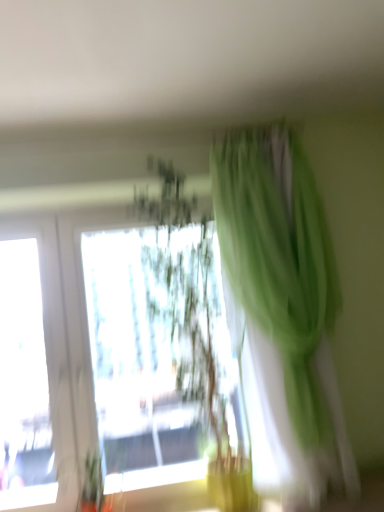
What do you see at coordinates (196, 327) in the screenshot?
I see `translucent green plant at center` at bounding box center [196, 327].

At what (x,y) coordinates should I click in order to perform the action: click on translucent green plant at center. Please return your answer as a coordinate pair (x, y). The width and height of the screenshot is (384, 512). Looking at the image, I should click on (196, 327).

Find the location of a particular element. The image size is (384, 512). green sheer curtain at upper right is located at coordinates (285, 300).

The height and width of the screenshot is (512, 384). Describe the element at coordinates (285, 300) in the screenshot. I see `green sheer curtain at upper right` at that location.

Where is `translucent green plant at center`? The width and height of the screenshot is (384, 512). translucent green plant at center is located at coordinates (196, 327).

In the image, is translucent green plant at center on the left side or the right side of green sheer curtain at upper right?

In the image, translucent green plant at center appears on the left side of green sheer curtain at upper right.

Is translucent green plant at center closer to camera compared to green sheer curtain at upper right?

No.

Which is further, (164, 213) or (244, 244)?

Point (164, 213)

From the image's perspective, would you say translucent green plant at center is shown under green sheer curtain at upper right?

Correct, translucent green plant at center appears lower than green sheer curtain at upper right in the image.

From a real-world perspective, between translucent green plant at center and green sheer curtain at upper right, who is vertically lower?

In real-world perspective, translucent green plant at center is lower.

Looking at this image, considering the sizes of objects translucent green plant at center and green sheer curtain at upper right in the image provided, who is thinner, translucent green plant at center or green sheer curtain at upper right?

green sheer curtain at upper right is thinner.

Considering the sizes of translucent green plant at center and green sheer curtain at upper right in the image, is translucent green plant at center taller or shorter than green sheer curtain at upper right?

Clearly, translucent green plant at center is taller compared to green sheer curtain at upper right.

Which of these two, translucent green plant at center or green sheer curtain at upper right, is bigger?

translucent green plant at center is bigger.

Is translucent green plant at center not within green sheer curtain at upper right?

That's correct, translucent green plant at center is outside of green sheer curtain at upper right.

Is translucent green plant at center not close to green sheer curtain at upper right?

No, translucent green plant at center is not far away from green sheer curtain at upper right.

Is green sheer curtain at upper right at the back of translucent green plant at center?

That's not correct — translucent green plant at center is not looking away from green sheer curtain at upper right.

This screenshot has height=512, width=384. What are the coordinates of `houseplant below the green sheer curtain at upper right (from a real-world perspective)` in the screenshot? It's located at (196, 327).

Does green sheer curtain at upper right appear on the left side of translucent green plant at center?

No.

Is green sheer curtain at upper right further to camera compared to translucent green plant at center?

That is False.

Does point (331, 442) appear closer or farther from the camera than point (209, 343)?

Point (331, 442) is positioned closer to the camera compared to point (209, 343).

From the image's perspective, which is above, green sheer curtain at upper right or translucent green plant at center?

From the image's view, green sheer curtain at upper right is above.

From a real-world perspective, is green sheer curtain at upper right positioned over translucent green plant at center based on gravity?

Yes, from a real-world perspective, green sheer curtain at upper right is above translucent green plant at center.

Is green sheer curtain at upper right wider or thinner than translucent green plant at center?

green sheer curtain at upper right is thinner than translucent green plant at center.

Considering the sizes of objects green sheer curtain at upper right and translucent green plant at center in the image provided, who is shorter, green sheer curtain at upper right or translucent green plant at center?

green sheer curtain at upper right is shorter.

Between green sheer curtain at upper right and translucent green plant at center, which one has larger size?

With larger size is translucent green plant at center.

Is green sheer curtain at upper right outside of translucent green plant at center?

Yes, green sheer curtain at upper right is outside of translucent green plant at center.

Is the surface of green sheer curtain at upper right in direct contact with translucent green plant at center?

green sheer curtain at upper right is not next to translucent green plant at center, and they're not touching.

From the picture: Does green sheer curtain at upper right turn towards translucent green plant at center?

No.

This screenshot has height=512, width=384. I want to click on houseplant that is on the left side of green sheer curtain at upper right, so click(196, 327).

The width and height of the screenshot is (384, 512). In order to click on houseplant that is below the green sheer curtain at upper right (from the image's perspective) in this screenshot , I will do `click(196, 327)`.

Identify the location of curtain that appears in front of the translucent green plant at center. Image resolution: width=384 pixels, height=512 pixels. (285, 300).